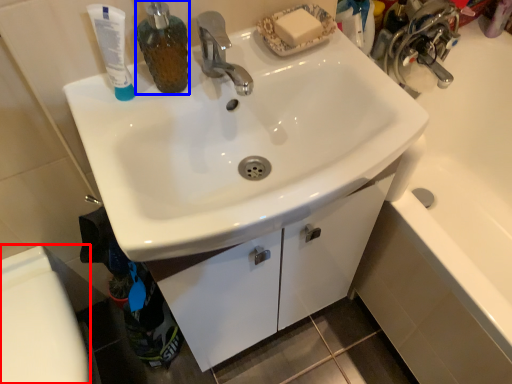
Question: Which object is further to the camera taking this photo, toilet bowl (highlighted by a red box) or soap dispenser (highlighted by a blue box)?

Choices:
 (A) toilet bowl
 (B) soap dispenser

Answer: (A)